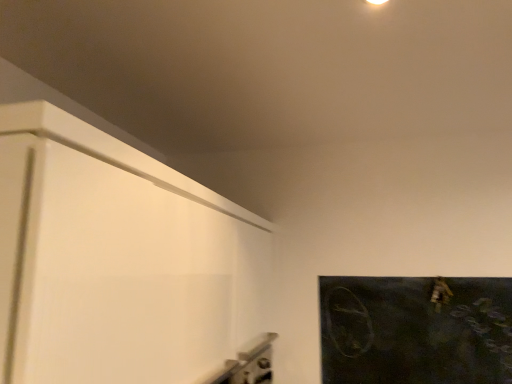
Measure the distance between point (440, 329) and camera.

They are 5.95 feet apart.

Image resolution: width=512 pixels, height=384 pixels. Describe the element at coordinates (415, 330) in the screenshot. I see `dark matte board at right` at that location.

Where is `dark matte board at right`? dark matte board at right is located at coordinates (415, 330).

In order to face dark matte board at right, should I rotate leftwards or rightwards?

You should rotate right by 20.583 degrees.

What are the coordinates of `dark matte board at right` in the screenshot? It's located at (415, 330).